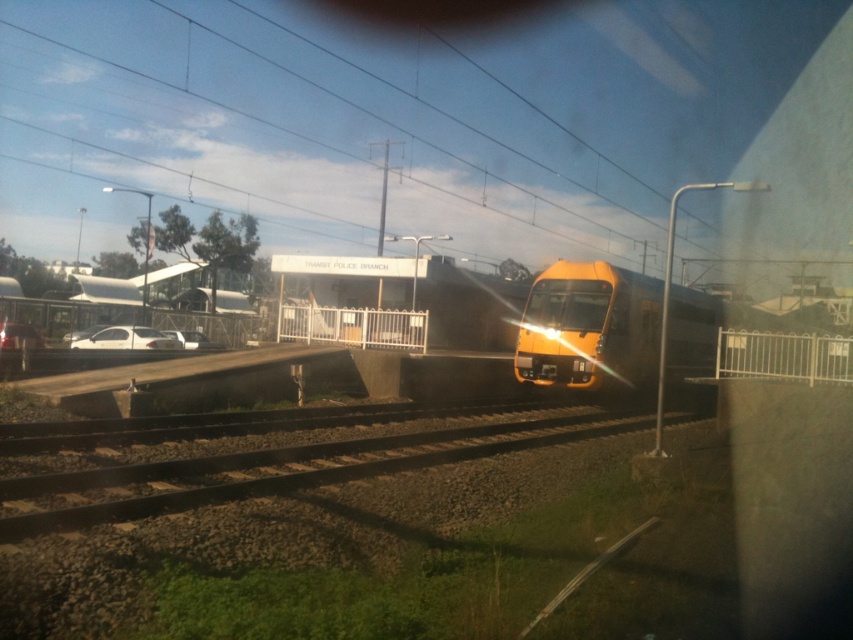
Question: Does yellow metallic train at center appear under white matte car at lower left?

Choices:
 (A) no
 (B) yes

Answer: (A)

Question: Which object is the closest to the metal tracks at center?

Choices:
 (A) white matte car at lower left
 (B) yellow metallic train at center
 (C) white matte car at left

Answer: (B)

Question: Can you confirm if white matte car at left is positioned to the right of white matte car at lower left?

Choices:
 (A) no
 (B) yes

Answer: (A)

Question: Can you confirm if metal tracks at center is positioned to the left of white matte car at left?

Choices:
 (A) yes
 (B) no

Answer: (B)

Question: Which of the following is the closest to the observer?

Choices:
 (A) (103, 348)
 (B) (74, 474)

Answer: (B)

Question: Which of the following is the closest to the observer?

Choices:
 (A) yellow metallic train at center
 (B) white matte car at lower left

Answer: (A)